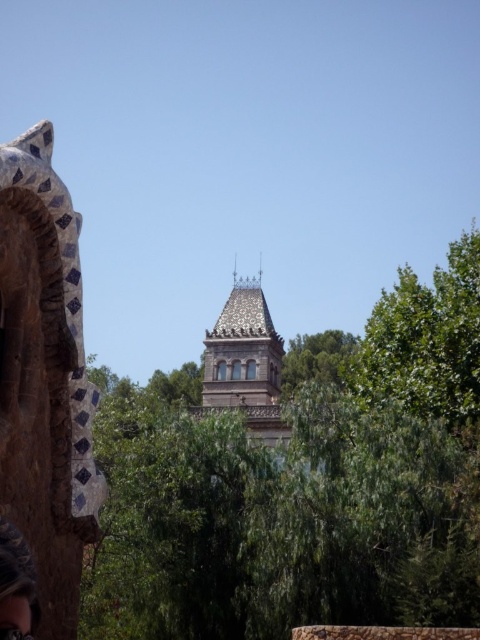
You are standing at the base of the tall ornate tower and want to take a photo of the point at coordinates (38, 332). The camera you are using has a maximum focus range of 200 feet. Will the point be in focus?

The point at coordinates (38, 332) is 187.06 feet away from the camera. Since this distance is within the camera maximum focus range of 200 feet, the point will be in focus.

You are standing in front of the polished stone tower at center and want to take a photo of the green leafy tree at center. Which direction should you turn to face the tree?

The green leafy tree at center is positioned on the right side of the polished stone tower at center, so you should turn to your right to face the tree.

You are standing in the scenic area and want to take a photo of the polished stone tower at center without the matte black hair at lower left appearing in the frame. Which object should you move closer to, and which should you move away from?

To avoid the matte black hair at lower left in the photo, move closer to the polished stone tower at center since it is closer to you, and move away from the matte black hair at lower left as it is farther away.